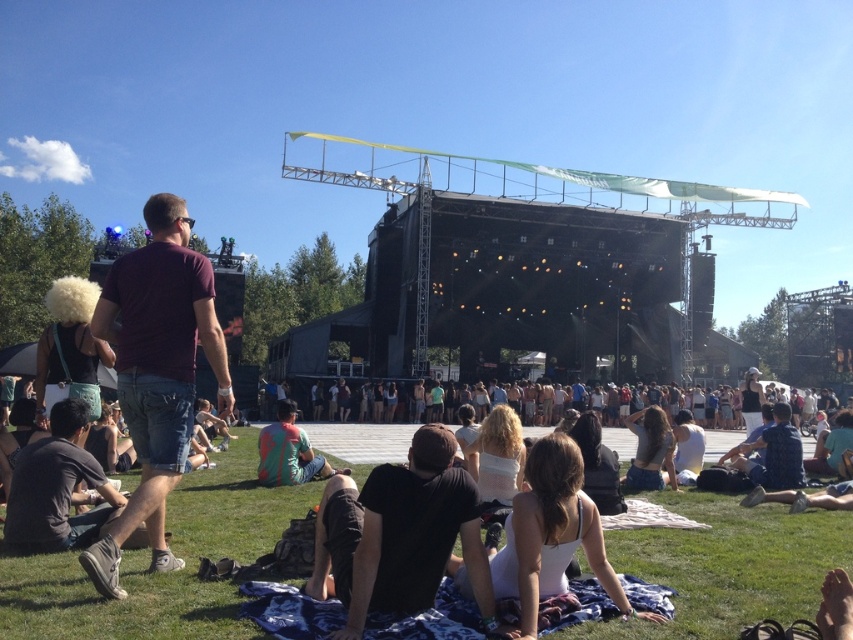
Question: Considering the real-world distances, which object is closest to the green grass at lower center?

Choices:
 (A) teal fabric shorts at center
 (B) white fabric at center

Answer: (B)

Question: Can you confirm if white fabric at center is smaller than blue patterned blanket at lower center?

Choices:
 (A) yes
 (B) no

Answer: (B)

Question: Is green grass at lower center closer to camera compared to white fabric at center?

Choices:
 (A) no
 (B) yes

Answer: (B)

Question: Is black cotton shirt at center wider than teal fabric shorts at center?

Choices:
 (A) yes
 (B) no

Answer: (B)

Question: Which point appears farthest from the camera in this image?

Choices:
 (A) (322, 532)
 (B) (561, 468)
 (C) (376, 625)

Answer: (A)

Question: Which object appears farthest from the camera in this image?

Choices:
 (A) denim shorts at lower right
 (B) teal fabric shorts at center
 (C) green grass at lower center

Answer: (A)